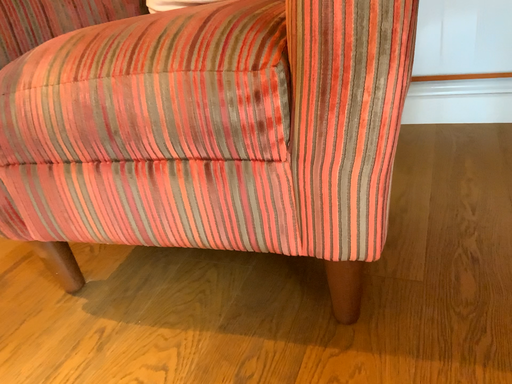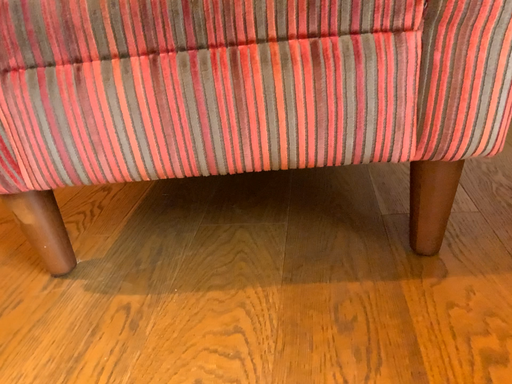
Question: Which way did the camera rotate in the video?

Choices:
 (A) rotated left
 (B) rotated right

Answer: (B)